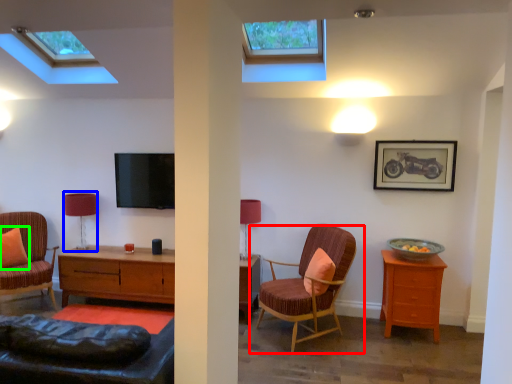
Question: Which object is the farthest from chair (highlighted by a red box)? Choose among these: table lamp (highlighted by a blue box) or pillow (highlighted by a green box).

Choices:
 (A) table lamp
 (B) pillow

Answer: (B)